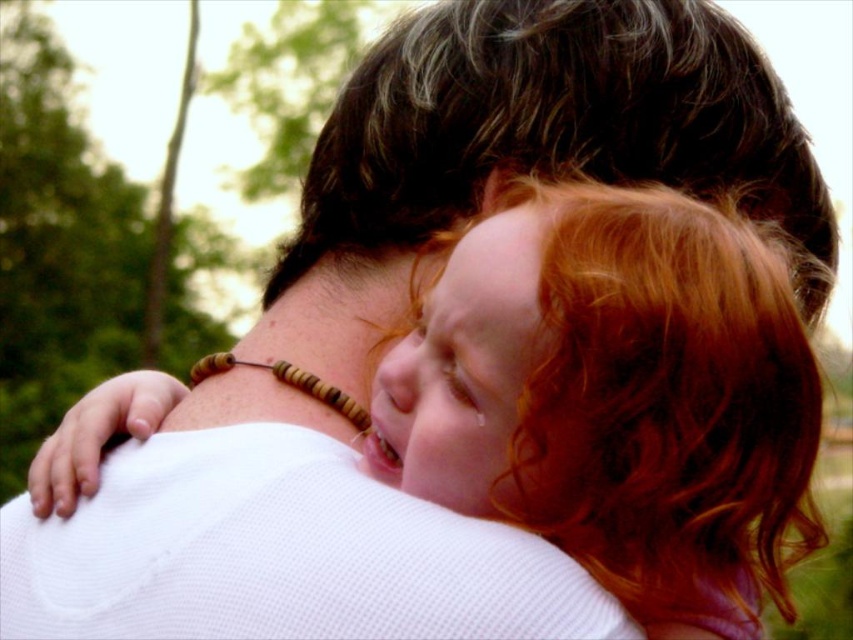
Is curly red hair at upper right below dark brown wavy hair at upper center?

Correct, curly red hair at upper right is located below dark brown wavy hair at upper center.

Is point (492, 243) positioned in front of point (746, 122)?

Yes, point (492, 243) is in front of point (746, 122).

At what (x,y) coordinates should I click in order to perform the action: click on curly red hair at upper right. Please return your answer as a coordinate pair (x, y). Looking at the image, I should click on (480, 456).